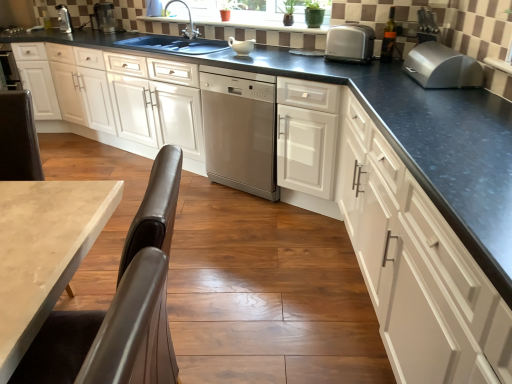
The height and width of the screenshot is (384, 512). I want to click on free point to the left of white glossy cabinets at right, which ranks as the 3th cabinetry in left-to-right order, so [x=220, y=279].